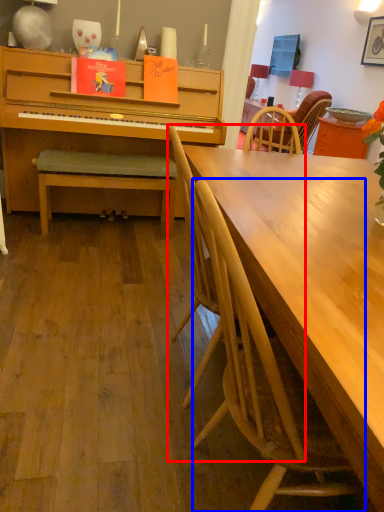
Question: Which object is further to the camera taking this photo, chair (highlighted by a red box) or chair (highlighted by a blue box)?

Choices:
 (A) chair
 (B) chair

Answer: (A)